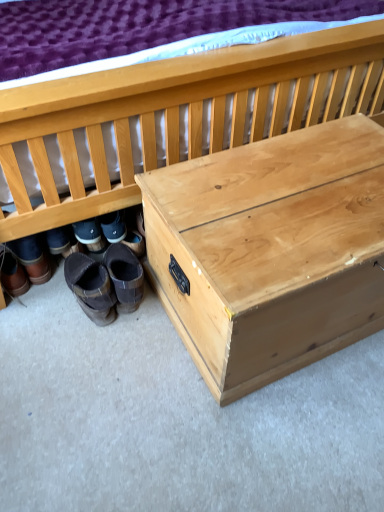
Question: Can you confirm if natural wood chest at lower right is taller than brown suede boots at lower left, acting as the 4th footwear starting from the left?

Choices:
 (A) yes
 (B) no

Answer: (A)

Question: From a real-world perspective, does natural wood chest at lower right sit lower than brown suede boots at lower left, the first footwear from the right?

Choices:
 (A) no
 (B) yes

Answer: (A)

Question: Is natural wood chest at lower right completely or partially outside of brown suede boots at lower left, the first footwear from the right?

Choices:
 (A) no
 (B) yes

Answer: (B)

Question: Is natural wood chest at lower right in front of brown suede boots at lower left, the first footwear from the right?

Choices:
 (A) no
 (B) yes

Answer: (B)

Question: Is natural wood chest at lower right far away from brown suede boots at lower left, acting as the 4th footwear starting from the left?

Choices:
 (A) no
 (B) yes

Answer: (A)

Question: In the image, is natural wood chest at lower right positioned in front of or behind natural wood trunk at center?

Choices:
 (A) behind
 (B) front

Answer: (B)

Question: Choose the correct answer: Is natural wood chest at lower right inside natural wood trunk at center or outside it?

Choices:
 (A) inside
 (B) outside

Answer: (B)

Question: Is natural wood chest at lower right wider or thinner than natural wood trunk at center?

Choices:
 (A) wide
 (B) thin

Answer: (A)

Question: From the image's perspective, is natural wood chest at lower right positioned above or below natural wood trunk at center?

Choices:
 (A) above
 (B) below

Answer: (A)

Question: Is natural wood trunk at center in front of or behind brown suede boots at lower left, which is counted as the third footwear, starting from the left, in the image?

Choices:
 (A) behind
 (B) front

Answer: (B)

Question: Looking at their shapes, would you say natural wood trunk at center is wider or thinner than brown suede boots at lower left, which ranks as the second footwear in right-to-left order?

Choices:
 (A) thin
 (B) wide

Answer: (B)

Question: In terms of size, does natural wood trunk at center appear bigger or smaller than brown suede boots at lower left, which is counted as the third footwear, starting from the left?

Choices:
 (A) big
 (B) small

Answer: (A)

Question: From the image's perspective, is natural wood trunk at center positioned above or below brown suede boots at lower left, which is counted as the third footwear, starting from the left?

Choices:
 (A) below
 (B) above

Answer: (B)

Question: In the image, is natural wood trunk at center positioned in front of or behind natural wood chest at lower right?

Choices:
 (A) behind
 (B) front

Answer: (A)

Question: Is point (x=241, y=298) closer or farther from the camera than point (x=16, y=229)?

Choices:
 (A) closer
 (B) farther

Answer: (A)